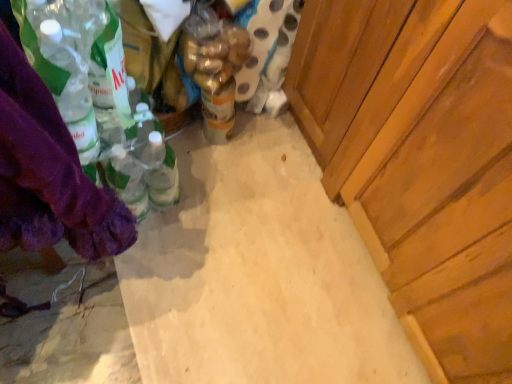
Question: Does yellow matte can at center appear on the right side of wooden cabinet at right?

Choices:
 (A) no
 (B) yes

Answer: (A)

Question: Considering the relative sizes of yellow matte can at center and wooden cabinet at right in the image provided, is yellow matte can at center bigger than wooden cabinet at right?

Choices:
 (A) no
 (B) yes

Answer: (A)

Question: Is yellow matte can at center turned away from wooden cabinet at right?

Choices:
 (A) no
 (B) yes

Answer: (B)

Question: Is yellow matte can at center closer to camera compared to wooden cabinet at right?

Choices:
 (A) no
 (B) yes

Answer: (A)

Question: From a real-world perspective, is yellow matte can at center beneath wooden cabinet at right?

Choices:
 (A) yes
 (B) no

Answer: (A)

Question: Is yellow matte can at center not inside wooden cabinet at right?

Choices:
 (A) no
 (B) yes

Answer: (B)

Question: Is translucent plastic bottle at center at the right side of yellow matte can at center?

Choices:
 (A) yes
 (B) no

Answer: (A)

Question: Are translucent plastic bottle at center and yellow matte can at center far apart?

Choices:
 (A) yes
 (B) no

Answer: (B)

Question: Can you confirm if translucent plastic bottle at center is wider than yellow matte can at center?

Choices:
 (A) no
 (B) yes

Answer: (B)

Question: From the image's perspective, is translucent plastic bottle at center beneath yellow matte can at center?

Choices:
 (A) no
 (B) yes

Answer: (A)

Question: From the image's perspective, is translucent plastic bottle at center located above yellow matte can at center?

Choices:
 (A) no
 (B) yes

Answer: (B)

Question: Does translucent plastic bottle at center have a greater height compared to yellow matte can at center?

Choices:
 (A) no
 (B) yes

Answer: (B)

Question: Is purple fabric at left outside of wooden cabinet at right?

Choices:
 (A) no
 (B) yes

Answer: (B)